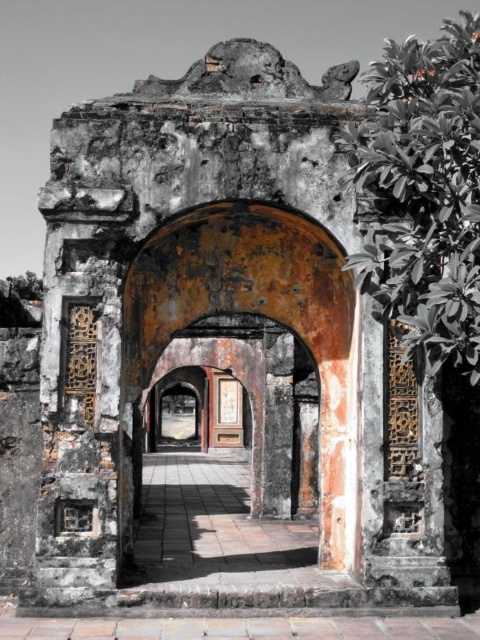
You are an architect inspecting the historical site. You notice a green leafy plant at upper right and a rusty metal archway at center. Which object is positioned higher in the image?

The green leafy plant at upper right is positioned higher in the image than the rusty metal archway at center.